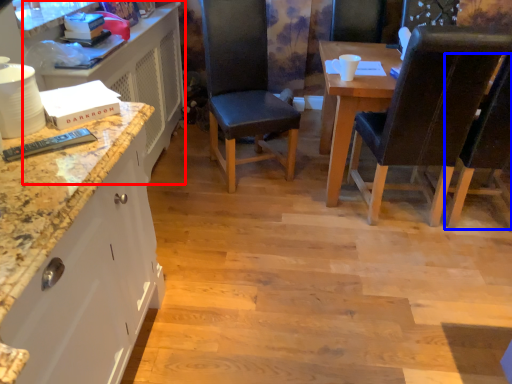
Question: Which point is closer to the camera, dresser (highlighted by a red box) or chair (highlighted by a blue box)?

Choices:
 (A) dresser
 (B) chair

Answer: (B)